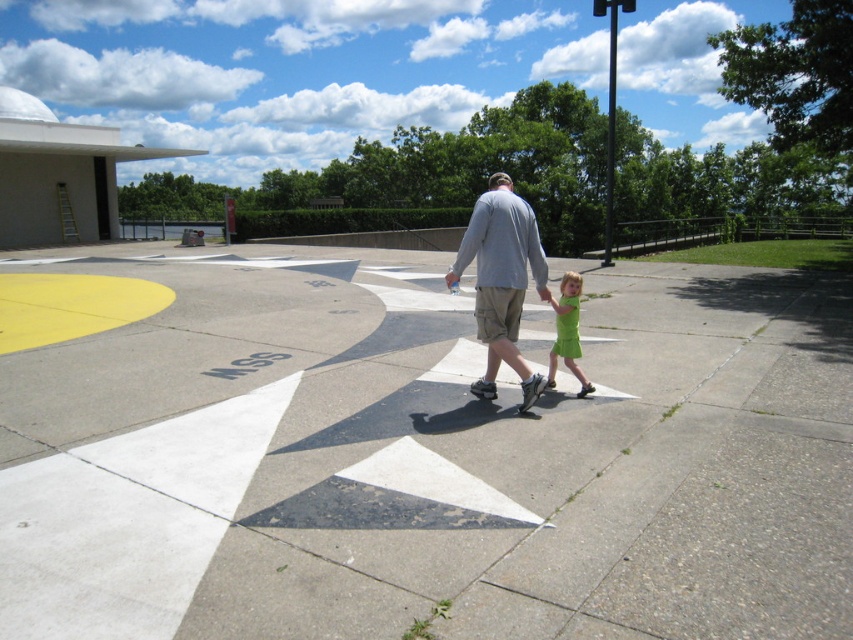
Question: Which object appears closest to the camera in this image?

Choices:
 (A) gray cotton shirt at center
 (B) gray concrete pavement at center
 (C) green cotton dress at lower right

Answer: (B)

Question: Which object is positioned farthest from the green cotton dress at lower right?

Choices:
 (A) gray cotton shirt at center
 (B) gray concrete pavement at center

Answer: (B)

Question: Does gray concrete pavement at center have a greater width compared to green cotton dress at lower right?

Choices:
 (A) no
 (B) yes

Answer: (B)

Question: Where is gray concrete pavement at center located in relation to green cotton dress at lower right in the image?

Choices:
 (A) left
 (B) right

Answer: (A)

Question: Can you confirm if gray cotton shirt at center is bigger than green cotton dress at lower right?

Choices:
 (A) no
 (B) yes

Answer: (B)

Question: Among these points, which one is nearest to the camera?

Choices:
 (A) (103, 568)
 (B) (508, 202)

Answer: (A)